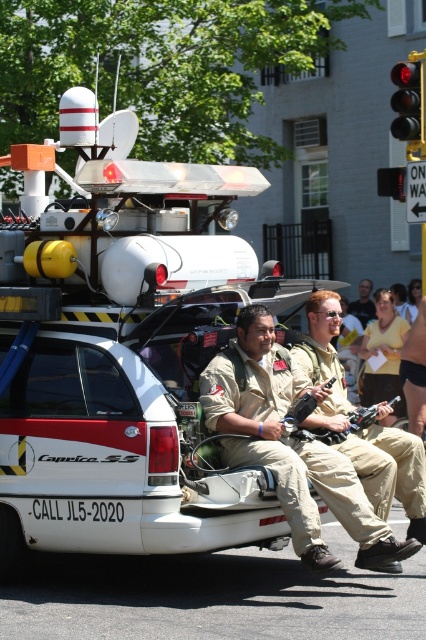
Question: Can you confirm if tan uniform at center is positioned below red glass traffic light at upper right?

Choices:
 (A) no
 (B) yes

Answer: (B)

Question: Estimate the real-world distances between objects in this image. Which object is closer to the tan uniform at center?

Choices:
 (A) black plastic traffic light at upper right
 (B) red glass traffic light at upper right
 (C) matte khaki uniform at center

Answer: (B)

Question: Can you confirm if black plastic traffic light at upper right is bigger than matte khaki uniform at center?

Choices:
 (A) no
 (B) yes

Answer: (A)

Question: Can you confirm if black plastic traffic light at upper right is positioned to the right of matte khaki uniform at center?

Choices:
 (A) yes
 (B) no

Answer: (A)

Question: Among these points, which one is farthest from the camera?

Choices:
 (A) (348, 308)
 (B) (333, 300)

Answer: (A)

Question: Which object is farther from the camera taking this photo?

Choices:
 (A) black plastic traffic light at upper right
 (B) tan uniform at center
 (C) matte khaki uniform at center

Answer: (C)